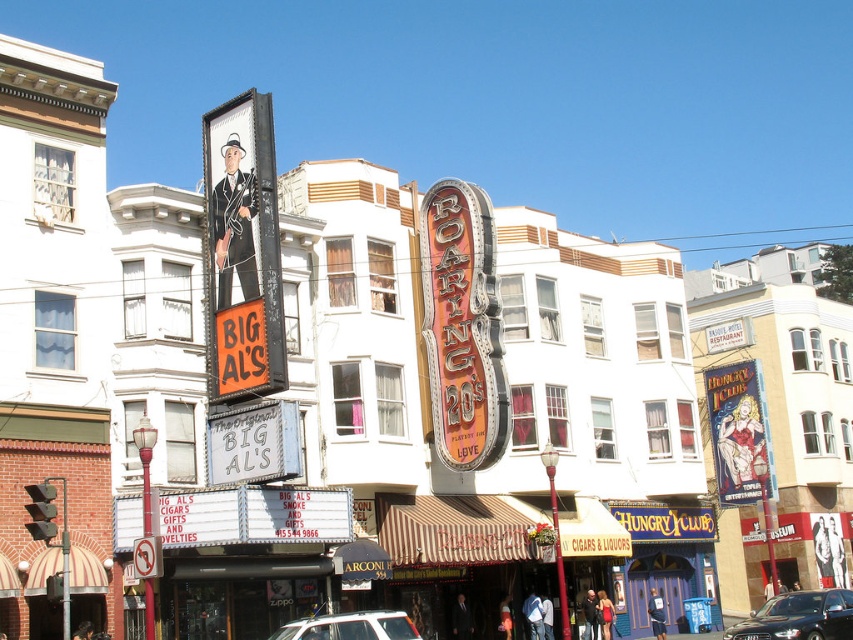
You are a delivery driver who needs to park your truck, which is 2 meters wide, in the street. Looking at the image, can you fit your truck between the metallic sign at upper left and the shiny black sedan at center?

The metallic sign at upper left is thinner than the shiny black sedan at center, but the description does not provide the exact width of the space between them. Therefore, it is uncertain if the truck can fit.